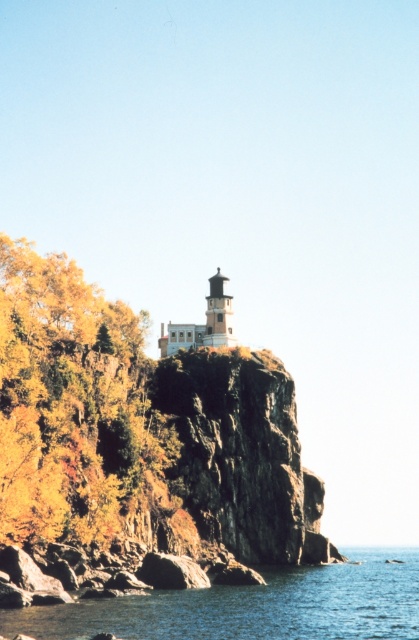
Consider the image. Which is more to the right, yellow-green foliage at left or blue water at lower center?

blue water at lower center

Locate an element on the screen. yellow-green foliage at left is located at coordinates (70, 403).